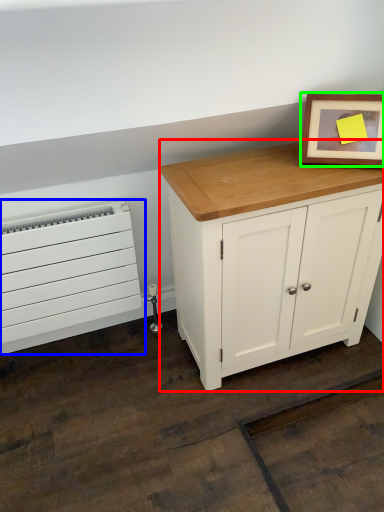
Question: Based on their relative distances, which object is farther from chest of drawers (highlighted by a red box)? Choose from heater (highlighted by a blue box) and picture frame (highlighted by a green box).

Choices:
 (A) heater
 (B) picture frame

Answer: (A)